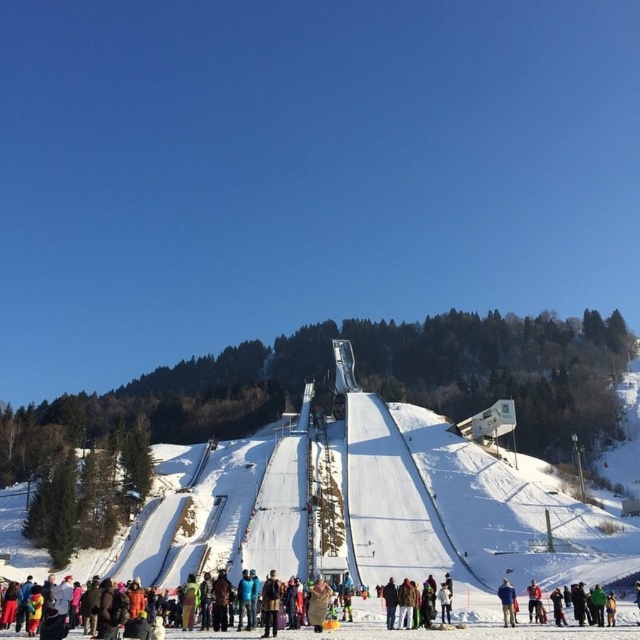
Is blue woolen sweater at center wider than red wool sweater at center?

Yes.

Which is in front, point (497, 589) or point (540, 602)?

Positioned in front is point (540, 602).

I want to click on blue woolen sweater at center, so click(506, 602).

Is brown wool coat at center to the left of red wool sweater at center from the viewer's perspective?

Indeed, brown wool coat at center is positioned on the left side of red wool sweater at center.

Between brown wool coat at center and red wool sweater at center, which one appears on the right side from the viewer's perspective?

red wool sweater at center

This screenshot has width=640, height=640. Find the location of `brown wool coat at center`. brown wool coat at center is located at coordinates (317, 604).

Between point (483, 609) and point (499, 588), which one is positioned in front?

Point (483, 609)

Does white snowboarder at center have a greater height compared to blue woolen sweater at center?

Yes, white snowboarder at center is taller than blue woolen sweater at center.

Who is more forward, (524, 628) or (502, 598)?

Point (524, 628) is in front.

This screenshot has height=640, width=640. Find the location of `white snowboarder at center`. white snowboarder at center is located at coordinates (470, 627).